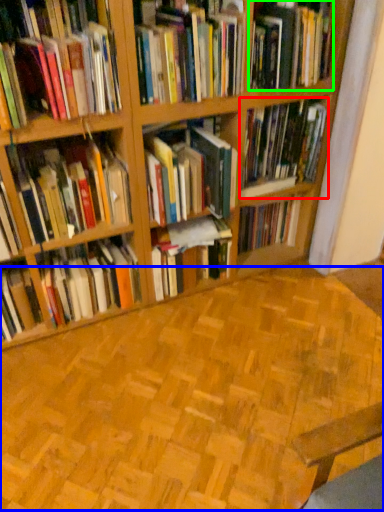
Question: Estimate the real-world distances between objects in this image. Which object is farther from book (highlighted by a red box), hardwood (highlighted by a blue box) or book (highlighted by a green box)?

Choices:
 (A) hardwood
 (B) book

Answer: (A)